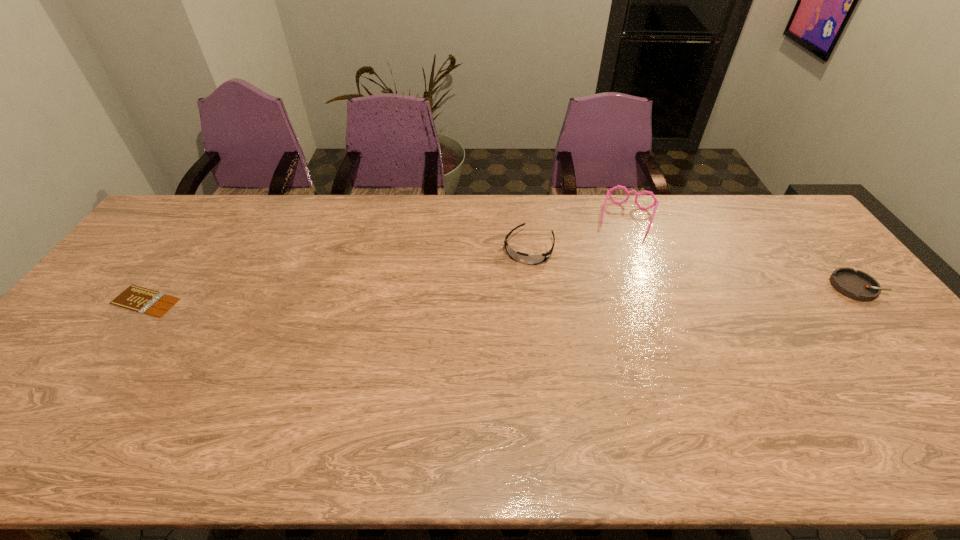
Find the location of a particular element. unoccupied position between the ashtray and the chocolate bar is located at coordinates (500, 294).

At what (x,y) coordinates should I click in order to perform the action: click on unoccupied position between the shortest object and the rightmost object. Please return your answer as a coordinate pair (x, y). Image resolution: width=960 pixels, height=540 pixels. Looking at the image, I should click on (500, 294).

Identify the location of free spot between the tallest object and the third tallest object. This screenshot has width=960, height=540. (741, 253).

Locate an element on the screen. vacant area that lies between the spectacles and the rightmost object is located at coordinates (741, 253).

What are the coordinates of `vacant space that is in between the chocolate bar and the ashtray` in the screenshot? It's located at (500, 294).

Select which object is the third closest to the sunglasses. Please provide its 2D coordinates. Your answer should be formatted as a tuple, i.e. [(x, y)], where the tuple contains the x and y coordinates of a point satisfying the conditions above.

[(135, 298)]

Point out which object is positioned as the second nearest to the third shortest object. Please provide its 2D coordinates. Your answer should be formatted as a tuple, i.e. [(x, y)], where the tuple contains the x and y coordinates of a point satisfying the conditions above.

[(857, 285)]

Locate an element on the screen. This screenshot has height=540, width=960. vacant space that satisfies the following two spatial constraints: 1. on the front side of the second tallest object; 2. on the right side of the rightmost object is located at coordinates (533, 286).

Where is `free region that satisfies the following two spatial constraints: 1. on the back side of the second shortest object; 2. on the right side of the chocolate bar`? Image resolution: width=960 pixels, height=540 pixels. free region that satisfies the following two spatial constraints: 1. on the back side of the second shortest object; 2. on the right side of the chocolate bar is located at coordinates (156, 286).

The height and width of the screenshot is (540, 960). I want to click on free region that satisfies the following two spatial constraints: 1. on the back side of the tallest object; 2. on the left side of the sunglasses, so click(x=525, y=219).